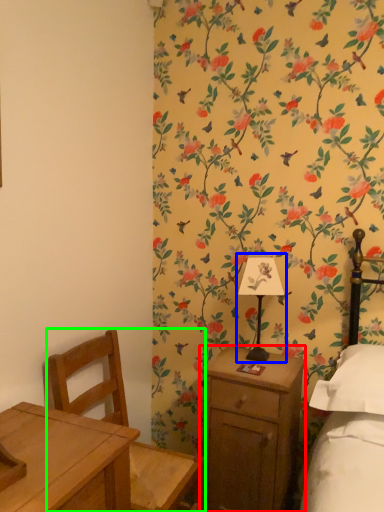
Question: Which object is the closest to the nightstand (highlighted by a red box)? Choose among these: bedside lamp (highlighted by a blue box) or chair (highlighted by a green box).

Choices:
 (A) bedside lamp
 (B) chair

Answer: (A)